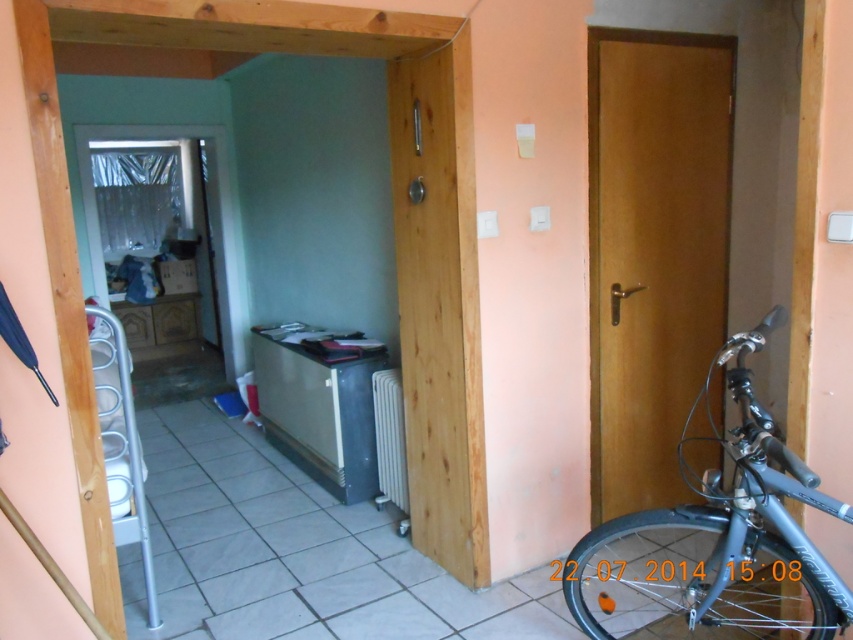
You are trying to move the silver metallic bicycle at right through the wooden door at center. Based on their widths, will the bicycle fit through the door?

The silver metallic bicycle at right is wider than the wooden door at center, so it will not fit through the door.

You are standing in the hallway and want to go through one of the doors. The wooden door at right and the wooden door at center are both options. Which door should you choose if you want to enter a room with a muted greenish blue wall?

The wooden door at center leads to the room with the muted greenish blue wall because the wooden door at right is near the peachy orange wall section, and the description states the adjacent room has a greenish blue tone. Since the wooden door at right is taller than the center door, but the color distinction is based on their positions relative to the wall colors.